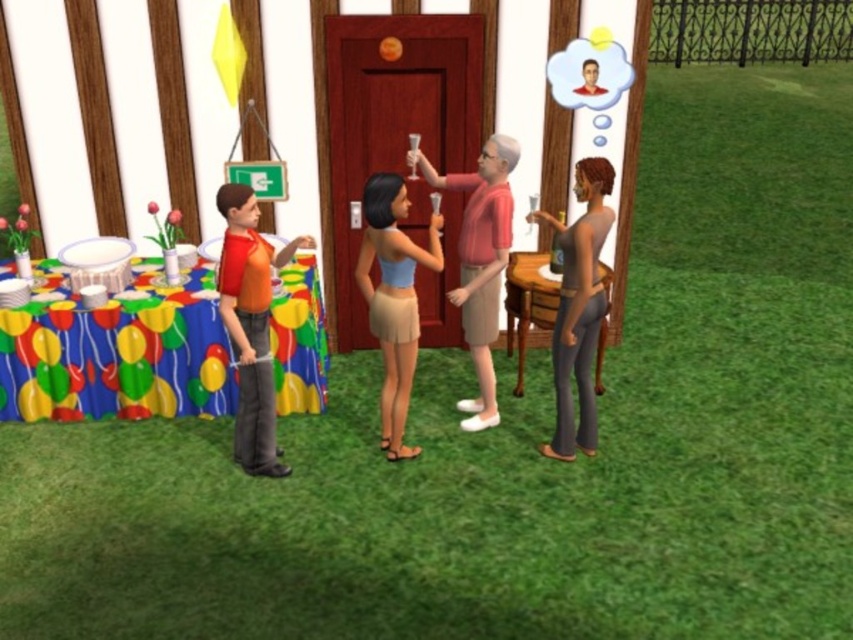
Question: Considering the relative positions of balloon-patterned tablecloth at lower left and matte pink shirt at center in the image provided, where is balloon-patterned tablecloth at lower left located with respect to matte pink shirt at center?

Choices:
 (A) below
 (B) above

Answer: (A)

Question: Among these points, which one is farthest from the camera?

Choices:
 (A) (512, 145)
 (B) (575, 234)
 (C) (381, 400)

Answer: (C)

Question: Does orange shirt at left have a lesser width compared to smooth gray pants at right?

Choices:
 (A) no
 (B) yes

Answer: (A)

Question: Estimate the real-world distances between objects in this image. Which object is closer to the balloon-patterned tablecloth at lower left?

Choices:
 (A) smooth gray pants at right
 (B) matte pink shirt at center

Answer: (B)

Question: Can you confirm if smooth gray pants at right is bigger than matte pink shirt at center?

Choices:
 (A) yes
 (B) no

Answer: (B)

Question: Among these objects, which one is nearest to the camera?

Choices:
 (A) smooth gray pants at right
 (B) matte pink shirt at center

Answer: (A)